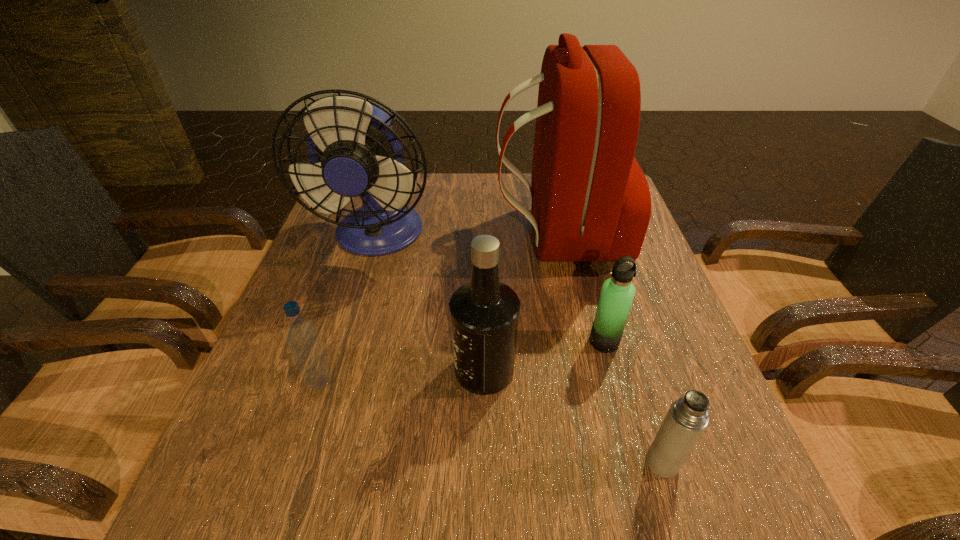
Identify the location of water bottle at the left edge. (302, 336).

I want to click on backpack that is positioned at the right edge, so click(590, 201).

The width and height of the screenshot is (960, 540). What are the coordinates of `object that is at the far left corner` in the screenshot? It's located at (354, 151).

I want to click on object that is positioned at the far right corner, so click(x=590, y=201).

This screenshot has height=540, width=960. Find the location of `vacant space at the far edge of the desktop`. vacant space at the far edge of the desktop is located at coordinates (435, 192).

Where is `vacant space at the near edge`? This screenshot has width=960, height=540. vacant space at the near edge is located at coordinates coord(628,522).

The width and height of the screenshot is (960, 540). What are the coordinates of `vacant space at the right edge of the desktop` in the screenshot? It's located at (656, 321).

This screenshot has height=540, width=960. Identify the location of empty location between the taller thermos bottle and the nearest object. (634, 402).

Locate an element on the screen. empty space between the shorter thermos bottle and the farther thermos bottle is located at coordinates (634, 402).

At what (x,y) coordinates should I click in order to perform the action: click on free space between the water bottle and the fan. Please return your answer as a coordinate pair (x, y). Looking at the image, I should click on point(349,309).